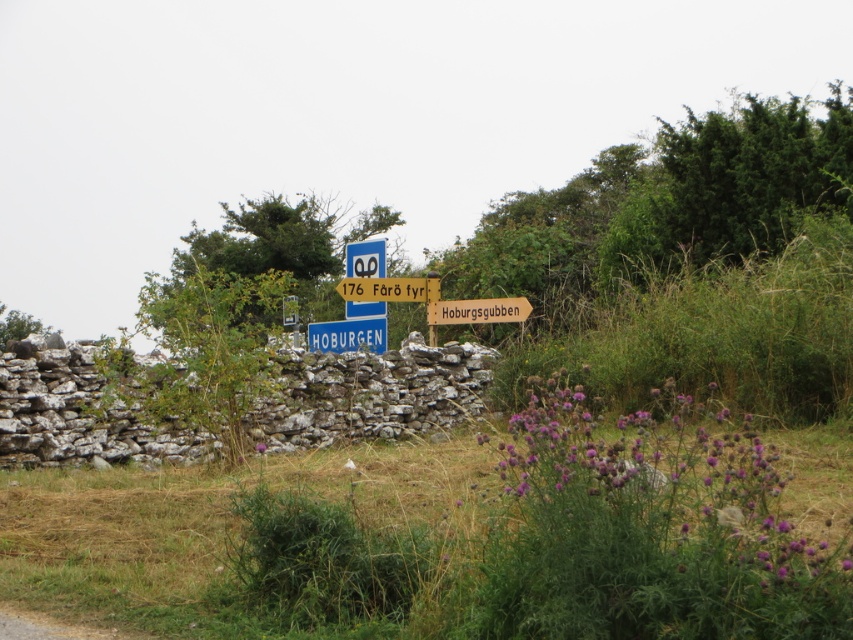
Question: Which point is closer to the camera?

Choices:
 (A) (453, 316)
 (B) (432, 269)

Answer: (A)

Question: Among these points, which one is nearest to the camera?

Choices:
 (A) (437, 276)
 (B) (525, 314)

Answer: (B)

Question: Among these objects, which one is nearest to the camera?

Choices:
 (A) brown wooden signpost at center
 (B) yellow wooden signpost at center

Answer: (A)

Question: Does brown wooden signpost at center come in front of yellow wooden signpost at center?

Choices:
 (A) yes
 (B) no

Answer: (A)

Question: Does brown wooden signpost at center come behind yellow wooden signpost at center?

Choices:
 (A) no
 (B) yes

Answer: (A)

Question: Is brown wooden signpost at center thinner than yellow wooden signpost at center?

Choices:
 (A) no
 (B) yes

Answer: (A)